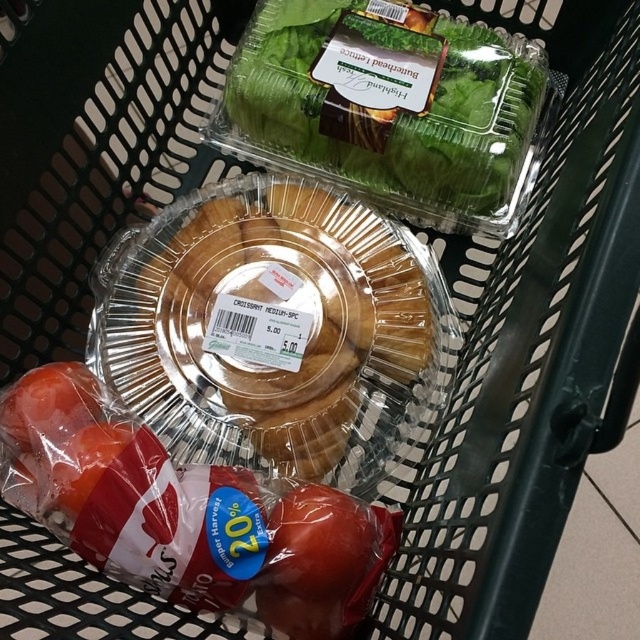
Question: Among these points, which one is farthest from the camera?

Choices:
 (A) (186, 276)
 (B) (289, 113)

Answer: (B)

Question: Is clear plastic pie at center further to camera compared to green leafy lettuce at upper center?

Choices:
 (A) no
 (B) yes

Answer: (A)

Question: Is clear plastic pie at center bigger than green leafy lettuce at upper center?

Choices:
 (A) no
 (B) yes

Answer: (B)

Question: Among these points, which one is farthest from the camera?

Choices:
 (A) (179, 209)
 (B) (497, 147)

Answer: (A)

Question: Which point is farther to the camera?

Choices:
 (A) clear plastic pie at center
 (B) green leafy lettuce at upper center

Answer: (B)

Question: Considering the relative positions of clear plastic pie at center and green leafy lettuce at upper center in the image provided, where is clear plastic pie at center located with respect to green leafy lettuce at upper center?

Choices:
 (A) right
 (B) left

Answer: (B)